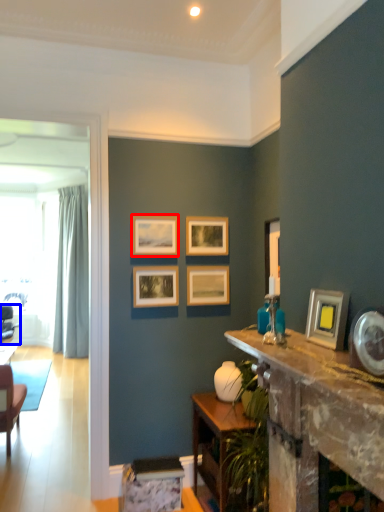
Question: Which object appears closest to the camera in this image, picture frame (highlighted by a red box) or chair (highlighted by a blue box)?

Choices:
 (A) picture frame
 (B) chair

Answer: (A)